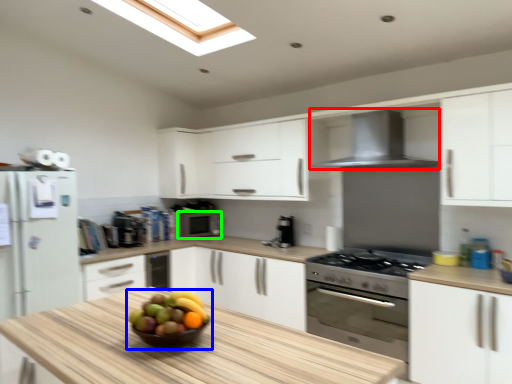
Question: Based on their relative distances, which object is farther from kitchen appliance (highlighted by a red box)? Choose from fruit dish (highlighted by a blue box) and appliance (highlighted by a green box).

Choices:
 (A) fruit dish
 (B) appliance

Answer: (B)